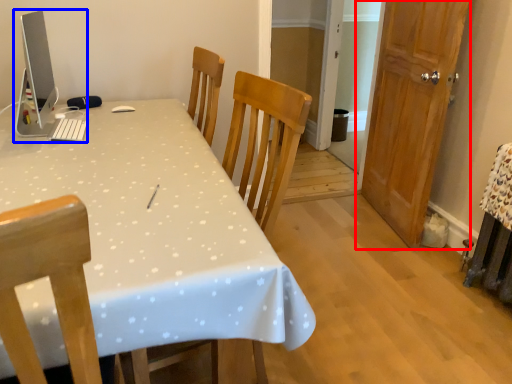
Question: Which of the following is the farthest to the observer, door (highlighted by a red box) or desktop computer (highlighted by a blue box)?

Choices:
 (A) door
 (B) desktop computer

Answer: (A)